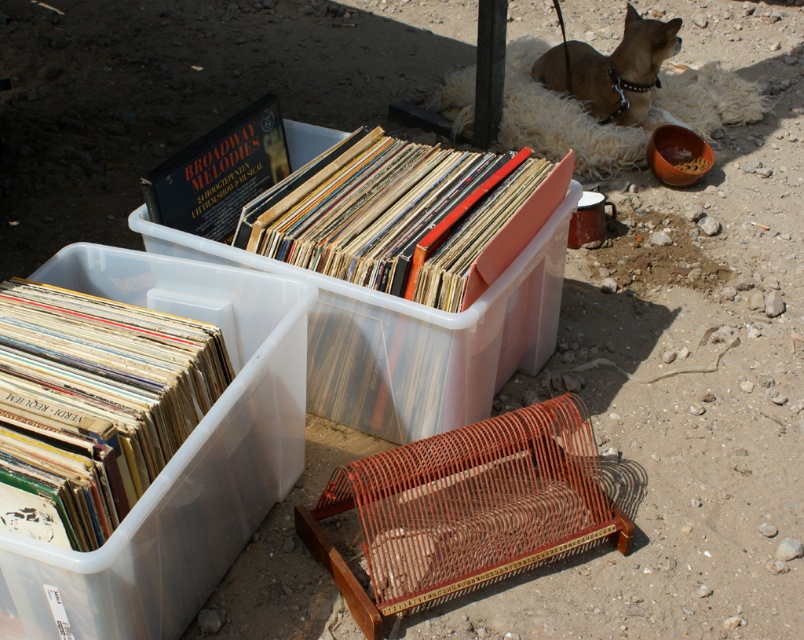
You are organizing items in the outdoor area and need to place a new item between the multicolored vinyl records at lower left and the hardcover book at upper center. Considering their sizes, which item should you place closer to the larger object to maintain balance?

The multicolored vinyl records at lower left is larger in size than the hardcover book at upper center, so you should place the new item closer to the multicolored vinyl records at lower left to maintain balance.

You are a delivery person who needs to place a new box of records next to the existing ones. The box is as wide as the brown fur dog at upper right. Can you fit it between the matte vinyl records at center and the red metal birdcage on the ground?

The matte vinyl records at center are wider than the brown fur dog at upper right. Since the box is as wide as the dog, it should fit between the matte vinyl records at center and the red metal birdcage on the ground as there is enough space.